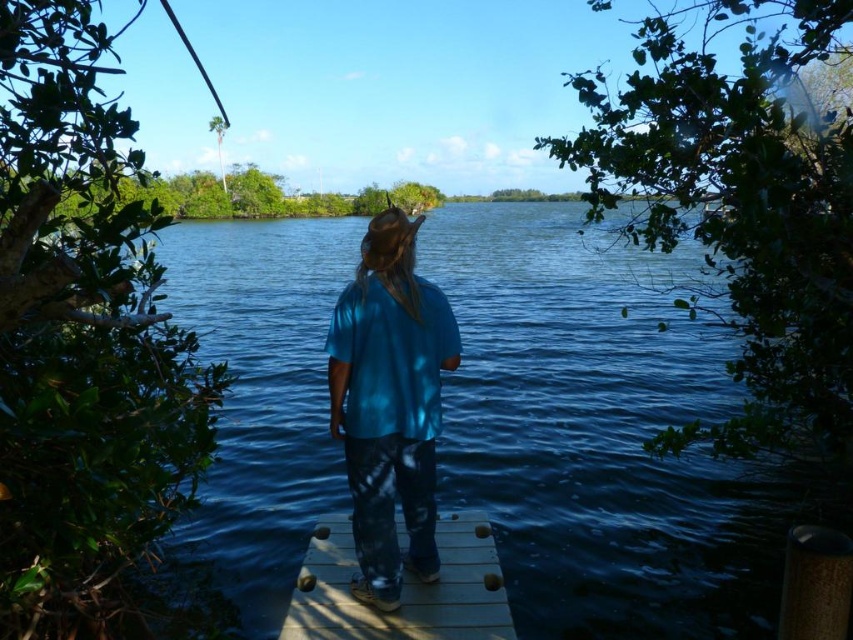
You are a photographer trying to capture the scene of the person on the dock. You notice the blue cotton shirt at center and the blue water at center. Which object is closer to the camera? Please explain your reasoning based on their positions.

The blue water at center is closer to the camera because the blue cotton shirt at center is positioned behind it.

You are standing on the wooden dock and want to see the blue water at center. Which direction should you look relative to the wooden at center?

The blue water at center is located above the wooden at center, so you should look upward from the wooden at center to see the blue water at center.